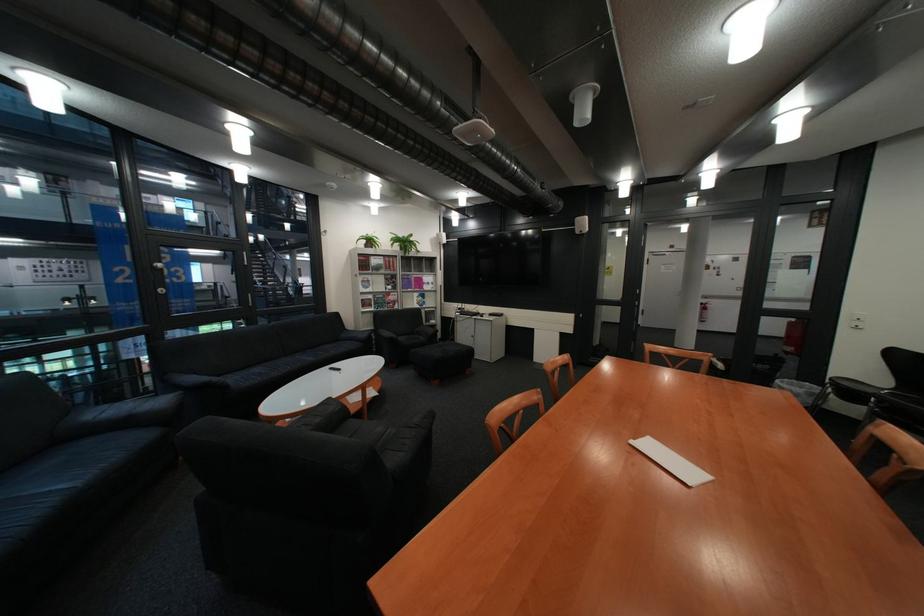
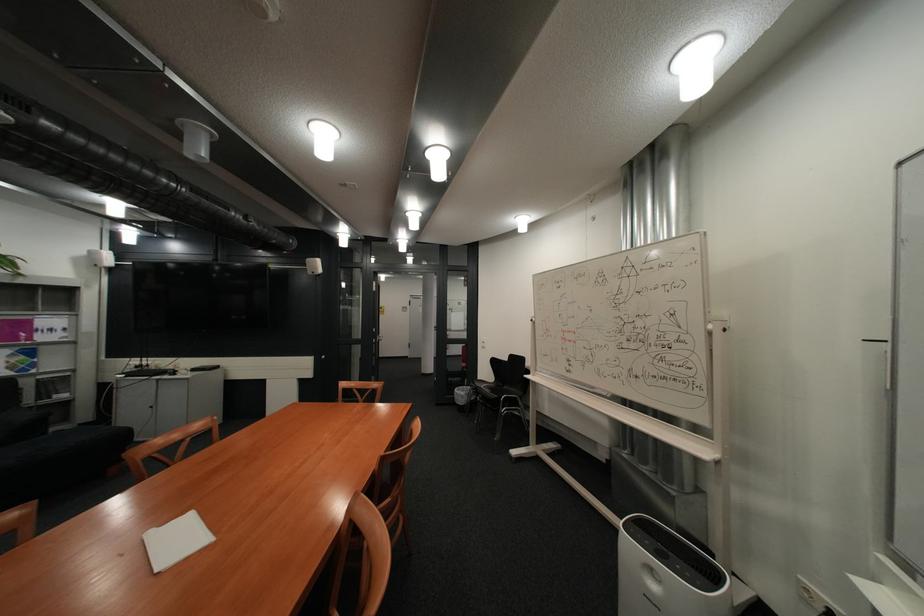
Where in the second image is the point corresponding to (x=859, y=383) from the first image?

(493, 383)